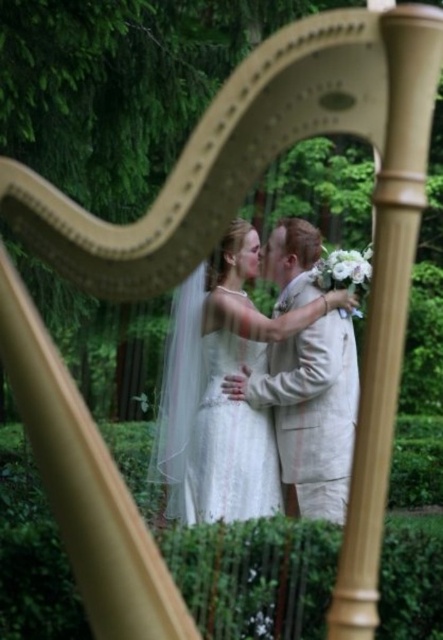
How much distance is there between white satin dress at center and white lace dress at center?

2.13 inches

Which of these two, white satin dress at center or white lace dress at center, stands shorter?

white lace dress at center

Does point (183, 358) come behind point (245, 477)?

Yes, it is.

The image size is (443, 640). What are the coordinates of `white satin dress at center` in the screenshot? It's located at (221, 388).

Between light beige linen suit at center and white lace dress at center, which one has less height?

white lace dress at center is shorter.

Can you confirm if light beige linen suit at center is positioned to the left of white lace dress at center?

In fact, light beige linen suit at center is to the right of white lace dress at center.

Is point (252, 390) behind point (218, 378)?

Yes.

You are a GUI agent. You are given a task and a screenshot of the screen. Output one action in this format:
    pyautogui.click(x=<x>, y=<y>)
    Task: Click on the light beige linen suit at center
    Image resolution: width=443 pixels, height=640 pixels.
    Given the screenshot: What is the action you would take?
    pyautogui.click(x=313, y=413)

Between white satin dress at center and light beige linen suit at center, which one is positioned lower?

white satin dress at center is below.

Identify the location of white satin dress at center. (221, 388).

Find the location of a particular element. white satin dress at center is located at coordinates (221, 388).